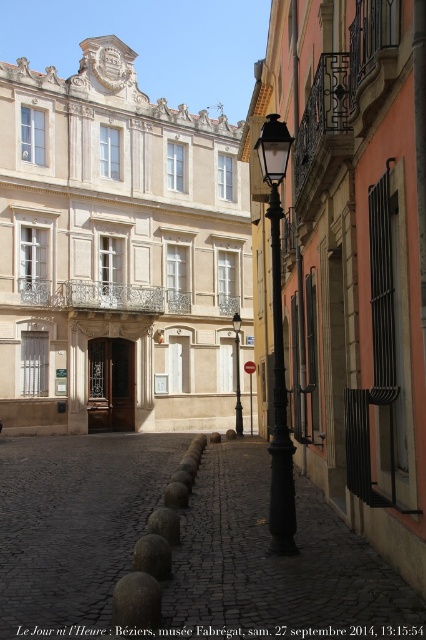
You are standing at the entrance of the Mus??e Fabr??gat, which is marked by a dark wooden door. You want to walk straight ahead towards the polished metal streetlamp at center. Is the streetlamp located in front of you or to your side?

The polished metal streetlamp at center is located at point (278,344), which is directly in front of the entrance. Therefore, walking straight ahead from the entrance will lead you directly to the streetlamp.

You are a city planner assessing the street layout in B?ziers, France. You notice two lamp fixtures along the street. The polished metal streetlamp at center and the black metal lamp post at center. Based on their widths, which lamp would require a wider base to maintain stability?

The polished metal streetlamp at center requires a wider base because its width surpasses that of the black metal lamp post at center, necessitating a broader foundation for stability.